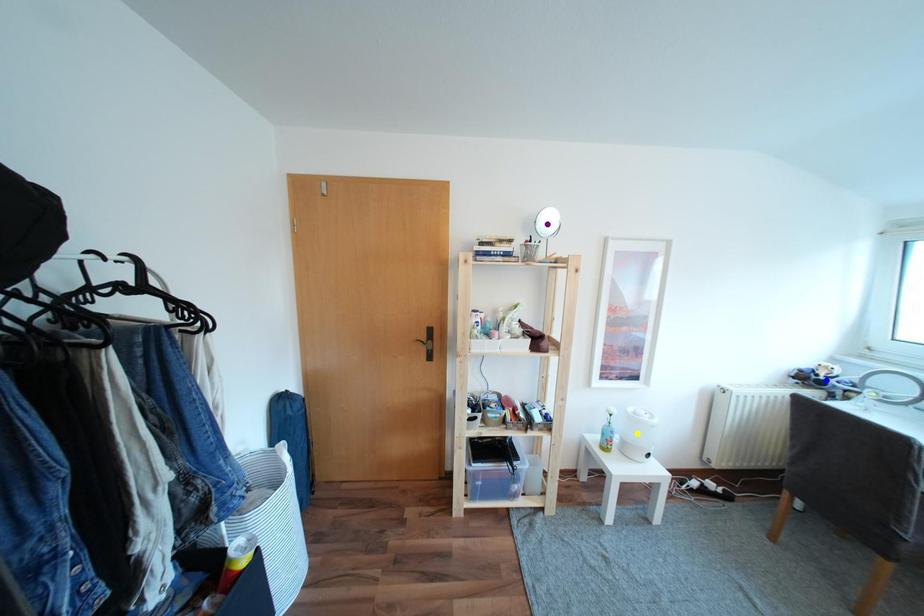
Order these from farthest to nearest:
1. blue point
2. yellow point
3. purple point

yellow point, blue point, purple point